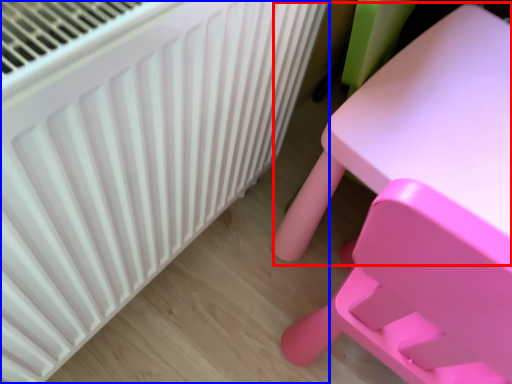
Question: Among these objects, which one is farthest to the camera, table (highlighted by a red box) or radiator (highlighted by a blue box)?

Choices:
 (A) table
 (B) radiator

Answer: (B)